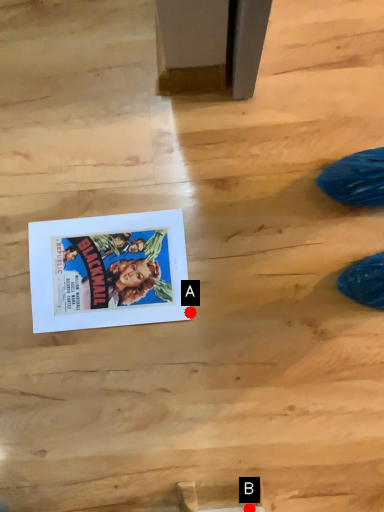
Question: Two points are circled on the image, labeled by A and B beside each circle. Which point appears farthest from the camera in this image?

Choices:
 (A) A is further
 (B) B is further

Answer: (A)